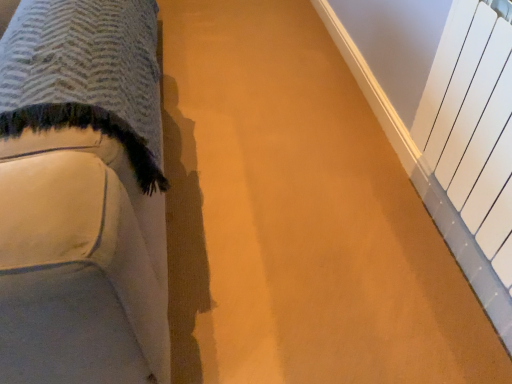
Locate an element on the screen. white matte radiator at right is located at coordinates (467, 96).

Measure the distance between white matte radiator at right and camera.

A distance of 35.47 inches exists between white matte radiator at right and camera.

The image size is (512, 384). What do you see at coordinates (467, 96) in the screenshot? I see `white matte radiator at right` at bounding box center [467, 96].

Where is `white fabric couch at left`? The width and height of the screenshot is (512, 384). white fabric couch at left is located at coordinates (82, 194).

The height and width of the screenshot is (384, 512). What do you see at coordinates (82, 194) in the screenshot?
I see `white fabric couch at left` at bounding box center [82, 194].

In order to face white fabric couch at left, should I rotate leftwards or rightwards?

Turn left approximately 28.603 degrees to face it.

At what (x,y) coordinates should I click in order to perform the action: click on white matte radiator at right. Please return your answer as a coordinate pair (x, y). Image resolution: width=512 pixels, height=384 pixels. Looking at the image, I should click on (467, 96).

Considering the relative positions of white fabric couch at left and white matte radiator at right in the image provided, is white fabric couch at left to the left or to the right of white matte radiator at right?

In the image, white fabric couch at left appears on the left side of white matte radiator at right.

In the image, is white fabric couch at left positioned in front of or behind white matte radiator at right?

white fabric couch at left is positioned closer to the viewer than white matte radiator at right.

Does point (139, 116) lie in front of point (464, 144)?

Yes, point (139, 116) is in front of point (464, 144).

From the image's perspective, is white fabric couch at left located above white matte radiator at right?

Correct, white fabric couch at left appears higher than white matte radiator at right in the image.

From a real-world perspective, is white fabric couch at left above or below white matte radiator at right?

From a real-world perspective, white fabric couch at left is physically below white matte radiator at right.

Can you confirm if white fabric couch at left is wider than white matte radiator at right?

Indeed, white fabric couch at left has a greater width compared to white matte radiator at right.

From their relative heights in the image, would you say white fabric couch at left is taller or shorter than white matte radiator at right?

Clearly, white fabric couch at left is taller compared to white matte radiator at right.

Looking at this image, does white fabric couch at left have a larger size compared to white matte radiator at right?

Indeed, white fabric couch at left has a larger size compared to white matte radiator at right.

Would you say white fabric couch at left is outside white matte radiator at right?

Yes, white fabric couch at left is outside of white matte radiator at right.

Is white fabric couch at left not near white matte radiator at right?

→ That's not correct — white fabric couch at left is a little close to white matte radiator at right.

Is white fabric couch at left oriented away from white matte radiator at right?

That's right, white fabric couch at left is facing away from white matte radiator at right.

How much distance is there between white fabric couch at left and white matte radiator at right?

white fabric couch at left is 33.54 inches from white matte radiator at right.

Find the location of `radiator behind the white fabric couch at left`. radiator behind the white fabric couch at left is located at coordinates (467, 96).

Is white matte radiator at right at the left side of white fabric couch at left?

No, white matte radiator at right is not to the left of white fabric couch at left.

In the image, is white matte radiator at right positioned in front of or behind white fabric couch at left?

In the image, white matte radiator at right appears behind white fabric couch at left.

Which is further, (x=480, y=64) or (x=135, y=203)?

Point (x=480, y=64)

From the image's perspective, which object appears higher, white matte radiator at right or white fabric couch at left?

white fabric couch at left, from the image's perspective.

From a real-world perspective, which is physically below, white matte radiator at right or white fabric couch at left?

white fabric couch at left, from a real-world perspective.

Can you confirm if white matte radiator at right is thinner than white fabric couch at left?

Yes, white matte radiator at right is thinner than white fabric couch at left.

Can you confirm if white matte radiator at right is shorter than white fabric couch at left?

Yes, white matte radiator at right is shorter than white fabric couch at left.

Is white matte radiator at right bigger than white fabric couch at left?

Actually, white matte radiator at right might be smaller than white fabric couch at left.

Can white fabric couch at left be found inside white matte radiator at right?

Definitely not — white fabric couch at left is not inside white matte radiator at right.

Is white matte radiator at right far from white fabric couch at left?

No, white matte radiator at right is not far away from white fabric couch at left.

Could you tell me if white matte radiator at right is facing white fabric couch at left?

Yes, white matte radiator at right is facing white fabric couch at left.

How different are the orientations of white matte radiator at right and white fabric couch at left in degrees?

The angle between the facing direction of white matte radiator at right and the facing direction of white fabric couch at left is 1.17 degrees.

Looking at this image, measure the distance from white matte radiator at right to white fabric couch at left.

white matte radiator at right is 85.20 centimeters from white fabric couch at left.

The width and height of the screenshot is (512, 384). What are the coordinates of `furniture in front of the white matte radiator at right` in the screenshot? It's located at (82, 194).

This screenshot has height=384, width=512. I want to click on furniture above the white matte radiator at right (from the image's perspective), so click(x=82, y=194).

The width and height of the screenshot is (512, 384). In order to click on furniture that is under the white matte radiator at right (from a real-world perspective) in this screenshot , I will do `click(82, 194)`.